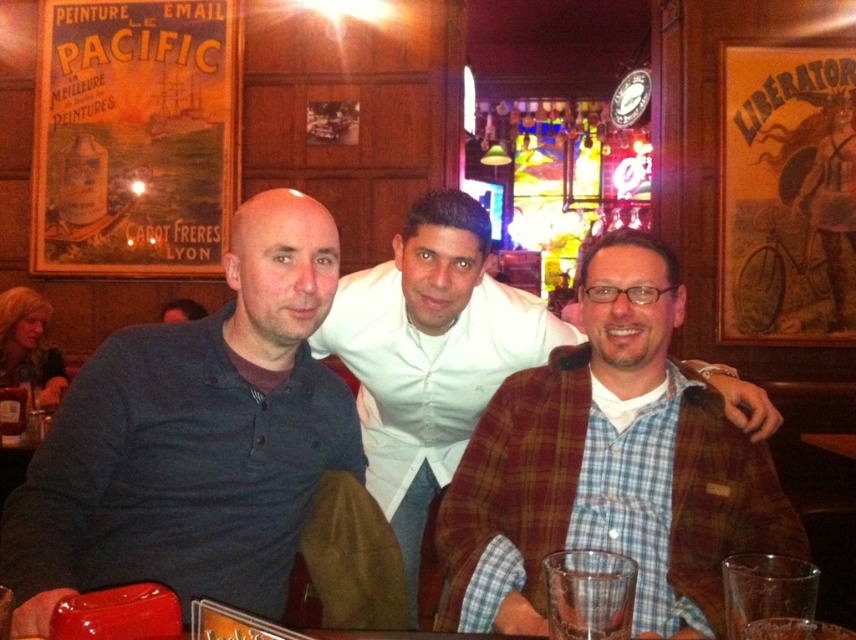
Question: Which point is farther to the camera?

Choices:
 (A) dark blue shirt at left
 (B) plaid wool jacket at center

Answer: (B)

Question: Does dark blue shirt at left have a larger size compared to plaid wool jacket at center?

Choices:
 (A) yes
 (B) no

Answer: (A)

Question: Which point is farther to the camera?

Choices:
 (A) plaid wool jacket at center
 (B) dark blue shirt at left

Answer: (A)

Question: Is dark blue shirt at left below plaid wool jacket at center?

Choices:
 (A) yes
 (B) no

Answer: (A)

Question: Can you confirm if dark blue shirt at left is positioned to the left of plaid wool jacket at center?

Choices:
 (A) yes
 (B) no

Answer: (A)